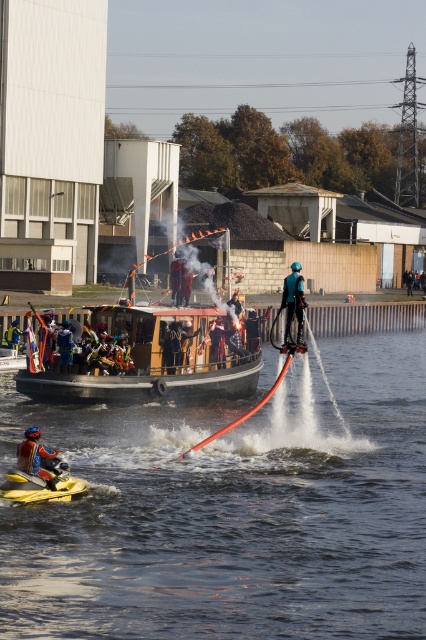
From the picture: Can you confirm if blue fabric life jacket at lower left is positioned below black leather jacket at center?

Yes.

Which is behind, point (28, 456) or point (187, 353)?

Positioned behind is point (187, 353).

At what (x,y) coordinates should I click in order to perform the action: click on blue fabric life jacket at lower left. Please return your answer as a coordinate pair (x, y). Looking at the image, I should click on (34, 456).

Does yellow rubber boat at lower left appear on the right side of black leather jacket at center?

Incorrect, yellow rubber boat at lower left is not on the right side of black leather jacket at center.

This screenshot has width=426, height=640. Find the location of `yellow rubber boat at lower left`. yellow rubber boat at lower left is located at coordinates (40, 484).

The height and width of the screenshot is (640, 426). I want to click on yellow rubber boat at lower left, so click(40, 484).

Who is shorter, clear water at jet ski right or yellow rubber boat at lower left?

yellow rubber boat at lower left

The image size is (426, 640). What do you see at coordinates (232, 512) in the screenshot?
I see `clear water at jet ski right` at bounding box center [232, 512].

You are a GUI agent. You are given a task and a screenshot of the screen. Output one action in this format:
    pyautogui.click(x=<x>, y=<y>)
    Task: Click on the clear water at jet ski right
    
    Given the screenshot: What is the action you would take?
    pyautogui.click(x=232, y=512)